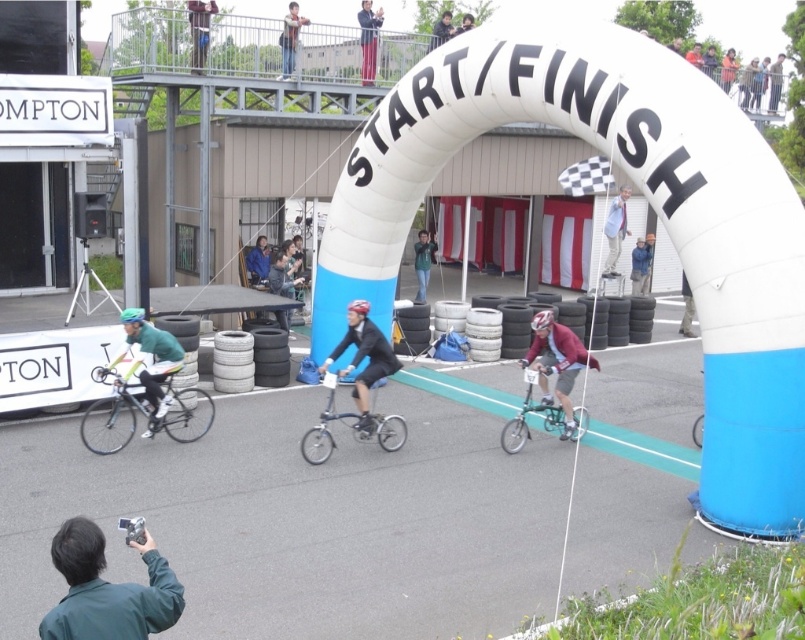
You are a photographer at the bicycle race event. You want to capture a photo of the green metallic bicycle at center and the blue fabric pants at upper center. Which object should you zoom in more on to make them appear the same size in the photo?

The green metallic bicycle at center has a smaller size compared to blue fabric pants at upper center, so you should zoom in more on the green metallic bicycle at center to make them appear the same size in the photo.

You are a photographer at the bicycle race event. You want to capture a photo of the red pants at upper center and the black rubber tire at center. Based on their positions, which object should you focus on first to ensure both are in the frame?

The red pants at upper center should be focused on first since the black rubber tire at center is to its right, allowing the photographer to position the red pants and then include the tire in the frame.